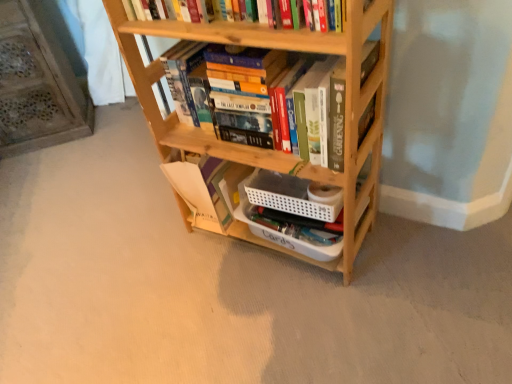
The height and width of the screenshot is (384, 512). Identify the location of natural wood bookcase at center. (269, 149).

This screenshot has width=512, height=384. What do you see at coordinates (37, 84) in the screenshot? I see `wooden bookshelf at left` at bounding box center [37, 84].

Find the location of a particular element. This screenshot has height=384, width=512. wooden bookshelf at center is located at coordinates (327, 114).

In the image, is natural wood bookcase at center positioned in front of or behind wooden bookshelf at left?

Clearly, natural wood bookcase at center is in front of wooden bookshelf at left.

In the scene shown: From a real-world perspective, is natural wood bookcase at center physically above wooden bookshelf at left?

Indeed, from a real-world perspective, natural wood bookcase at center stands above wooden bookshelf at left.

What's the angular difference between natural wood bookcase at center and wooden bookshelf at left's facing directions?

They differ by 43.5 degrees in their facing directions.

Consider the image. From the image's perspective, is natural wood bookcase at center above or below wooden bookshelf at center?

From the image's perspective, natural wood bookcase at center appears below wooden bookshelf at center.

Can you confirm if natural wood bookcase at center is positioned to the right of wooden bookshelf at center?

Yes, natural wood bookcase at center is to the right of wooden bookshelf at center.

Is wooden bookshelf at center a part of natural wood bookcase at center?

That's correct, wooden bookshelf at center is inside natural wood bookcase at center.

Which is farther, (x=234, y=167) or (x=362, y=127)?

The point (x=234, y=167) is more distant.

From a real-world perspective, between wooden bookshelf at center and wooden bookshelf at left, who is vertically higher?

wooden bookshelf at center is physically above.

Looking at their sizes, would you say wooden bookshelf at center is wider or thinner than wooden bookshelf at left?

Clearly, wooden bookshelf at center has less width compared to wooden bookshelf at left.

Is point (370, 43) behind point (16, 83)?

That is False.

From the image's perspective, which one is positioned lower, wooden bookshelf at center or wooden bookshelf at left?

wooden bookshelf at center.

Is wooden bookshelf at left to the left or to the right of wooden bookshelf at center in the image?

In the image, wooden bookshelf at left appears on the left side of wooden bookshelf at center.

In terms of size, does wooden bookshelf at left appear bigger or smaller than wooden bookshelf at center?

Considering their sizes, wooden bookshelf at left takes up more space than wooden bookshelf at center.

Does wooden bookshelf at left have a lesser height compared to wooden bookshelf at center?

No.

In terms of width, does wooden bookshelf at left look wider or thinner when compared to wooden bookshelf at center?

In the image, wooden bookshelf at left appears to be wider than wooden bookshelf at center.

How far apart are wooden bookshelf at center and natural wood bookcase at center?

The distance of wooden bookshelf at center from natural wood bookcase at center is 5.41 inches.

Consider the image. Between wooden bookshelf at center and natural wood bookcase at center, which one has smaller size?

With smaller size is wooden bookshelf at center.

Which of these two, wooden bookshelf at center or natural wood bookcase at center, is thinner?

Thinner between the two is wooden bookshelf at center.

In the scene shown: Is wooden bookshelf at center far from natural wood bookcase at center?

No, wooden bookshelf at center is not far from natural wood bookcase at center.

Is wooden bookshelf at left facing away from natural wood bookcase at center?

No, wooden bookshelf at left is not facing away from natural wood bookcase at center.

From the image's perspective, which one is positioned lower, wooden bookshelf at left or natural wood bookcase at center?

natural wood bookcase at center, from the image's perspective.

Does wooden bookshelf at left contain natural wood bookcase at center?

No, natural wood bookcase at center is located outside of wooden bookshelf at left.

Is wooden bookshelf at left bigger than natural wood bookcase at center?

No.

In the image, there is a wooden bookshelf at left. At what (x,y) coordinates should I click in order to perform the action: click on bookcase below it (from the image's perspective). Please return your answer as a coordinate pair (x, y). The image size is (512, 384). Looking at the image, I should click on (269, 149).

This screenshot has width=512, height=384. What are the coordinates of `bookcase in front of the wooden bookshelf at center` in the screenshot? It's located at (269, 149).

Based on their spatial positions, is natural wood bookcase at center or wooden bookshelf at left closer to wooden bookshelf at center?

natural wood bookcase at center lies closer to wooden bookshelf at center than the other object.

Based on their spatial positions, is wooden bookshelf at left or wooden bookshelf at center further from natural wood bookcase at center?

The object further to natural wood bookcase at center is wooden bookshelf at left.

Looking at the image, which one is located further to wooden bookshelf at center, wooden bookshelf at left or natural wood bookcase at center?

wooden bookshelf at left is further to wooden bookshelf at center.

Considering their positions, is wooden bookshelf at center positioned closer to natural wood bookcase at center than wooden bookshelf at left?

wooden bookshelf at center lies closer to natural wood bookcase at center than the other object.

Looking at the image, which one is located further to wooden bookshelf at left, natural wood bookcase at center or wooden bookshelf at center?

wooden bookshelf at center.

Looking at this image, when comparing their distances from wooden bookshelf at left, does wooden bookshelf at center or natural wood bookcase at center seem closer?

Based on the image, natural wood bookcase at center appears to be nearer to wooden bookshelf at left.

I want to click on book between wooden bookshelf at left and natural wood bookcase at center from left to right, so click(x=327, y=114).